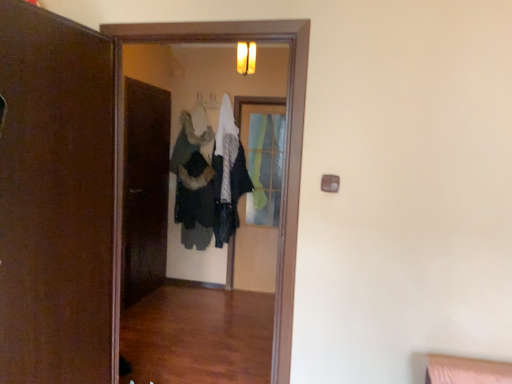
Find the location of a particular element. Image resolution: width=512 pixels, height=384 pixels. vacant space to the left of clear glass screen door at center, positioned as the 1th screen door in back-to-front order is located at coordinates (239, 293).